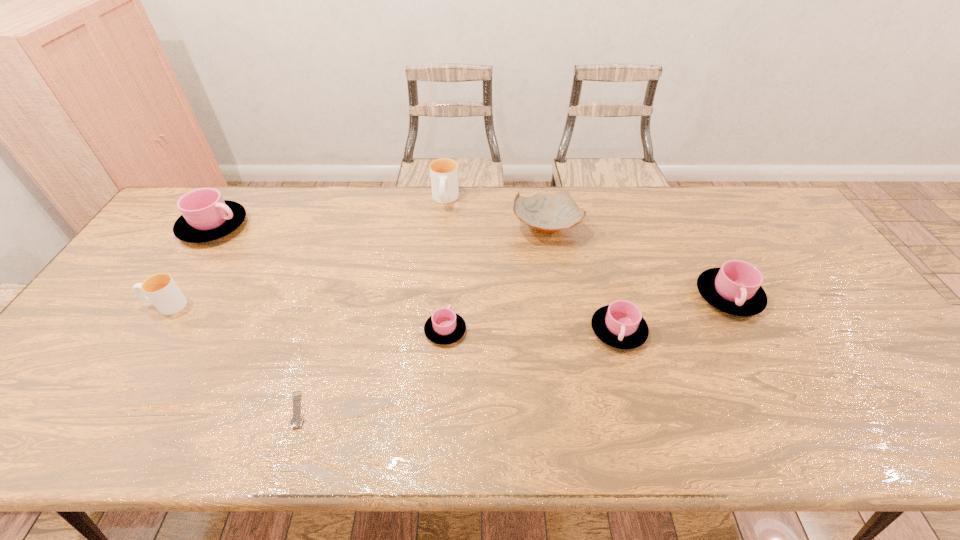
What are the coordinates of `the third pink cup from left to right` in the screenshot? It's located at (620, 325).

Find the location of a particular element. This screenshot has width=960, height=540. the seventh tallest object is located at coordinates (444, 327).

You are a GUI agent. You are given a task and a screenshot of the screen. Output one action in this format:
    pyautogui.click(x=<x>, y=<y>)
    Task: Click on the shortest cup
    
    Given the screenshot: What is the action you would take?
    pyautogui.click(x=444, y=327)

What are the coordinates of `the shortest object` in the screenshot? It's located at (296, 421).

I want to click on the sixth object from right to left, so click(x=296, y=421).

Locate an element on the screen. This screenshot has width=960, height=540. free space located 0.160m with the handle on the side of the farther yellow cup is located at coordinates pyautogui.click(x=441, y=244).

I want to click on free spot located on the side with the handle of the leftmost pink cup, so click(354, 227).

At what (x,y) coordinates should I click in order to perform the action: click on free space located on the front of the pottery. Please return your answer as a coordinate pair (x, y). This screenshot has width=960, height=540. Looking at the image, I should click on (563, 333).

You are a GUI agent. You are given a task and a screenshot of the screen. Output one action in this format:
    pyautogui.click(x=<x>, y=<y>)
    Task: Click on the vacant space located 0.100m on the side with the handle of the rightmost pink cup
    The image size is (960, 540).
    Given the screenshot: What is the action you would take?
    pyautogui.click(x=758, y=353)

Identify the location of vacant space situated with the handle on the side of the nearer yellow cup. (106, 305).